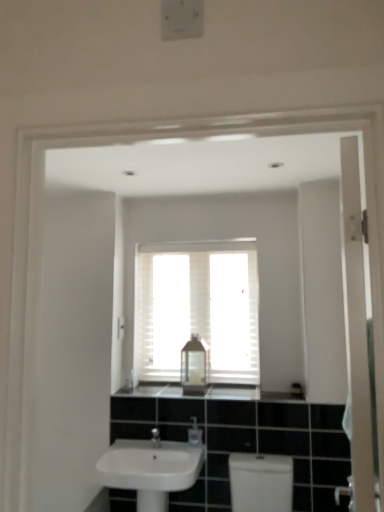
You are a GUI agent. You are given a task and a screenshot of the screen. Output one action in this format:
    pyautogui.click(x=<x>, y=<y>)
    Task: Click on the free space in front of transparent plastic bottle at center
    The image size is (384, 512).
    Given the screenshot: What is the action you would take?
    pyautogui.click(x=190, y=392)